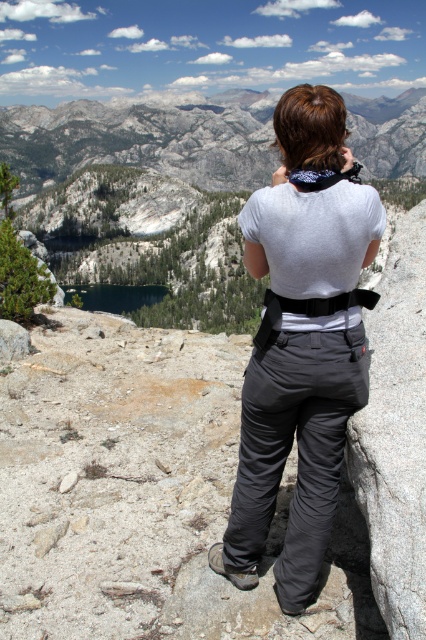
You are a photographer planning to take a photo of the gray rock formation at upper center and the deep blue water at center. Which object should you focus on first if you want to ensure both are in sharp focus?

You should focus on the gray rock formation at upper center first because it is closer to you than the deep blue water at center. By focusing on the closer object, the background object may still be in acceptable focus depending on the lens and aperture used.

You are standing at the point marked by the coordinates point (143, 140) in the image. What is the nearest object to you?

The nearest object to you is the gray rock formation at upper center marked by point (143, 140).